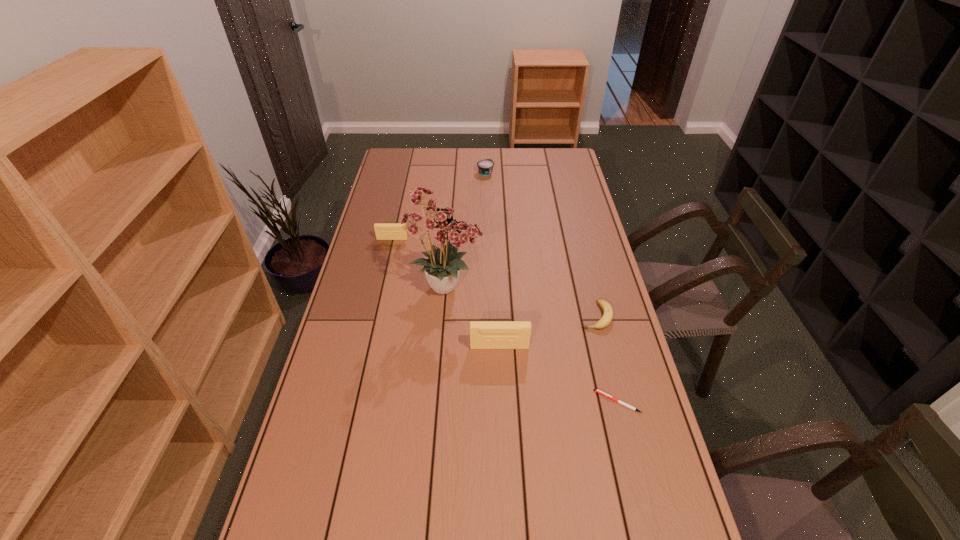
Where is `banana positioned at the right edge`? This screenshot has height=540, width=960. banana positioned at the right edge is located at coordinates (607, 317).

Identify the location of pen that is at the right edge. This screenshot has width=960, height=540. (596, 390).

Where is `vacant space at the far edge`? The image size is (960, 540). vacant space at the far edge is located at coordinates (496, 148).

I want to click on free space at the near edge of the desktop, so click(512, 502).

Find the location of `free point at the left edge`. free point at the left edge is located at coordinates (381, 178).

What are the coordinates of `free space at the right edge of the desktop` in the screenshot? It's located at (584, 280).

Where is `vacant space at the far left corner of the desktop`? Image resolution: width=960 pixels, height=540 pixels. vacant space at the far left corner of the desktop is located at coordinates (408, 157).

This screenshot has width=960, height=540. What are the coordinates of `vacant space at the far right corner of the desktop` in the screenshot? It's located at (576, 173).

Where is `empty location between the banana and the second nearest object`? empty location between the banana and the second nearest object is located at coordinates point(547,331).

The width and height of the screenshot is (960, 540). In order to click on free area in between the nearest object and the banana in this screenshot , I will do `click(607, 359)`.